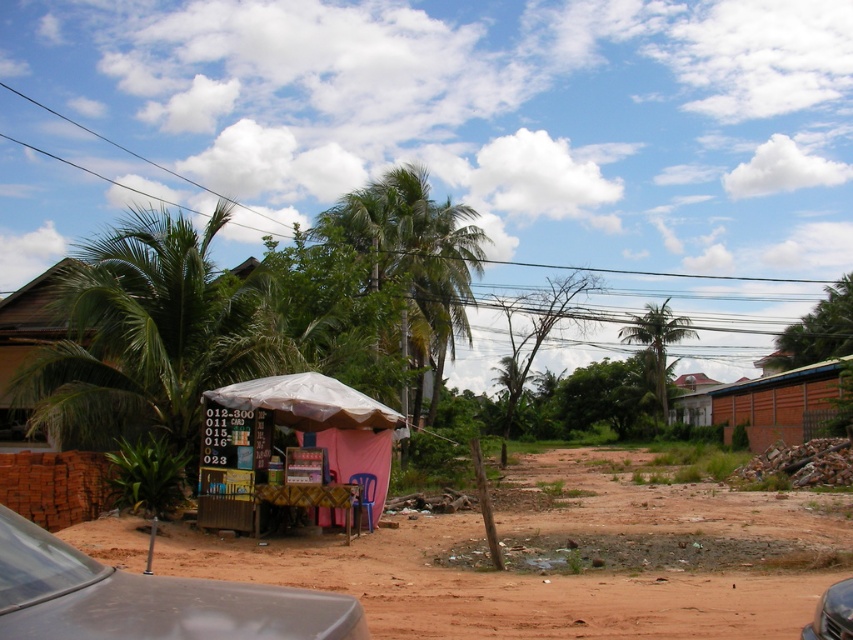
You are a delivery person trying to park your metallic gray car at lower left near the stall. Is there enough space to park next to the brown dirt field at lower left without blocking the stall?

The brown dirt field at lower left is positioned under metallic gray car at lower left, which means the car is already parked there. Therefore, there is no additional space to park next to the dirt field without blocking the stall.

You are a delivery person trying to park your metallic gray car at lower right near the stall. There is a brown dirt field at lower left in the way. Can you drive around it without going onto the field?

The brown dirt field at lower left is closer to you than the metallic gray car at lower right. Since the car is further away, you can drive around the field by staying on the path next to the stall and avoid the field.